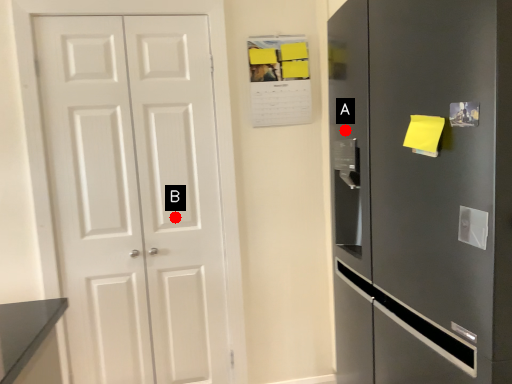
Question: Two points are circled on the image, labeled by A and B beside each circle. Which point appears closest to the camera in this image?

Choices:
 (A) A is closer
 (B) B is closer

Answer: (A)